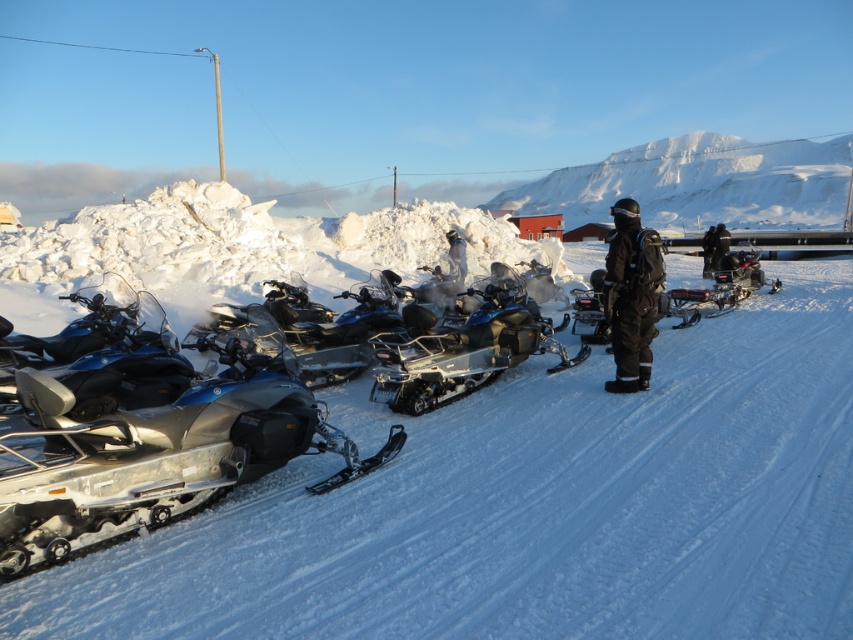
Is shiny metallic snowmobile at center wider than black matte snowsuit at center?

Indeed, shiny metallic snowmobile at center has a greater width compared to black matte snowsuit at center.

Who is positioned more to the right, shiny metallic snowmobile at center or black matte snowsuit at center?

black matte snowsuit at center

Find the location of a particular element. This screenshot has height=640, width=853. shiny metallic snowmobile at center is located at coordinates (466, 348).

The image size is (853, 640). Describe the element at coordinates (532, 506) in the screenshot. I see `white powdery snow at center` at that location.

Which of these two, white powdery snow at center or metallic blue snowmobile at center-left, stands shorter?

metallic blue snowmobile at center-left

The height and width of the screenshot is (640, 853). What do you see at coordinates (532, 506) in the screenshot?
I see `white powdery snow at center` at bounding box center [532, 506].

Where is `white powdery snow at center`? The image size is (853, 640). white powdery snow at center is located at coordinates (532, 506).

Does white powdery snow at center have a greater height compared to shiny metallic snowmobile at center?

Yes, white powdery snow at center is taller than shiny metallic snowmobile at center.

Measure the distance between white powdery snow at center and shiny metallic snowmobile at center.

white powdery snow at center is 3.97 feet from shiny metallic snowmobile at center.

Is point (454, 472) closer to viewer compared to point (531, 316)?

Yes, it is.

The image size is (853, 640). In order to click on white powdery snow at center in this screenshot , I will do `click(532, 506)`.